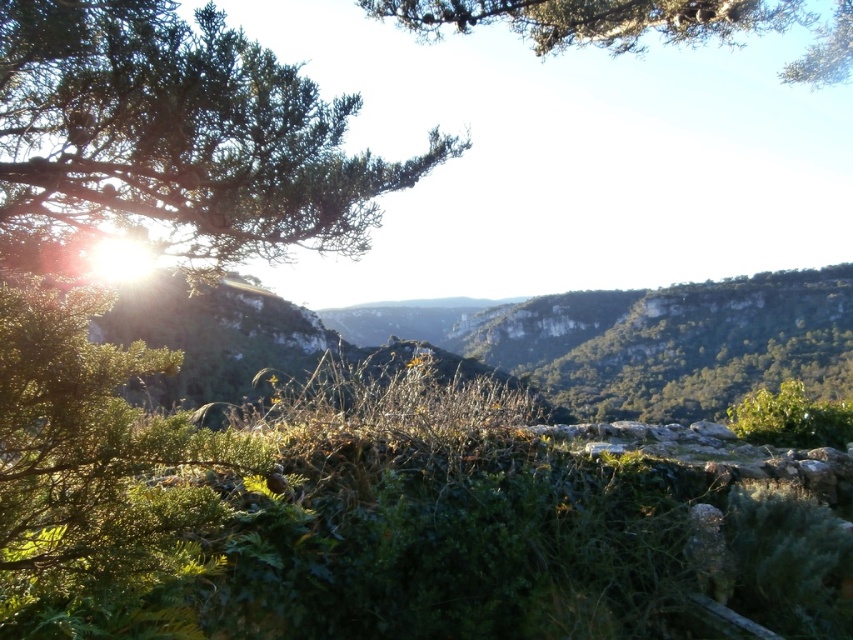
You are an artist sketching this landscape and want to ensure the positioning of the green leafy branch at upper left and the green leafy tree at upper center is accurate. According to the scene, which object is positioned more to the left?

The green leafy branch at upper left is positioned more to the left than the green leafy tree at upper center.

You are standing at the point closest to the bottom left corner of the image. You want to walk towards the point located at the top right corner of the image. However, there is an obstacle at point (10, 173). Can you walk around it by moving towards point (482, 10) instead?

Point (10, 173) is in front of point (482, 10), so you cannot reach point (482, 10) because the obstacle is blocking your path.

You are an artist sketching this landscape and want to ensure proper proportions. Which object among the green leafy branch at upper left and the green leafy tree at upper center should you draw smaller in your sketch?

The green leafy branch at upper left should be drawn smaller than the green leafy tree at upper center in your sketch.